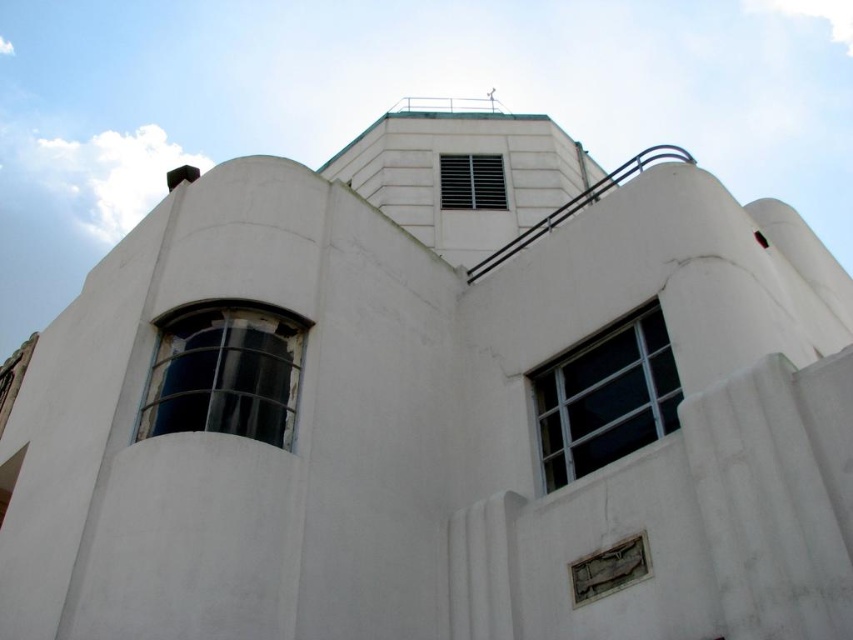
Question: Which point is farther from the camera taking this photo?

Choices:
 (A) (450, 157)
 (B) (605, 429)

Answer: (A)

Question: Can you confirm if dark glass window at left is wider than clear glass window at upper right?

Choices:
 (A) no
 (B) yes

Answer: (B)

Question: Which of the following is the farthest from the observer?

Choices:
 (A) clear glass window at upper right
 (B) metallic grid vent at upper center
 (C) dark glass window at left

Answer: (B)

Question: Does dark glass window at left have a greater width compared to clear glass window at upper right?

Choices:
 (A) yes
 (B) no

Answer: (A)

Question: Can you confirm if clear glass window at upper right is wider than metallic grid vent at upper center?

Choices:
 (A) yes
 (B) no

Answer: (B)

Question: Which object appears closest to the camera in this image?

Choices:
 (A) metallic grid vent at upper center
 (B) dark glass window at left

Answer: (B)